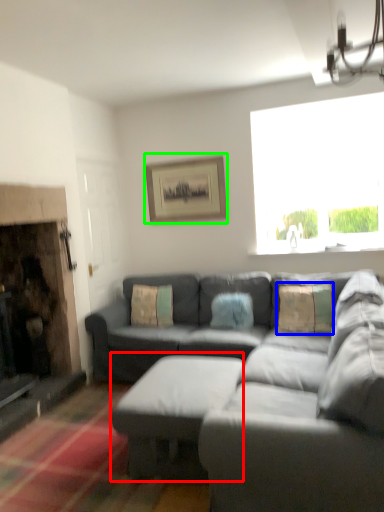
Question: Which is nearer to the table (highlighted by a red box)? pillow (highlighted by a blue box) or picture frame (highlighted by a green box).

Choices:
 (A) pillow
 (B) picture frame

Answer: (A)